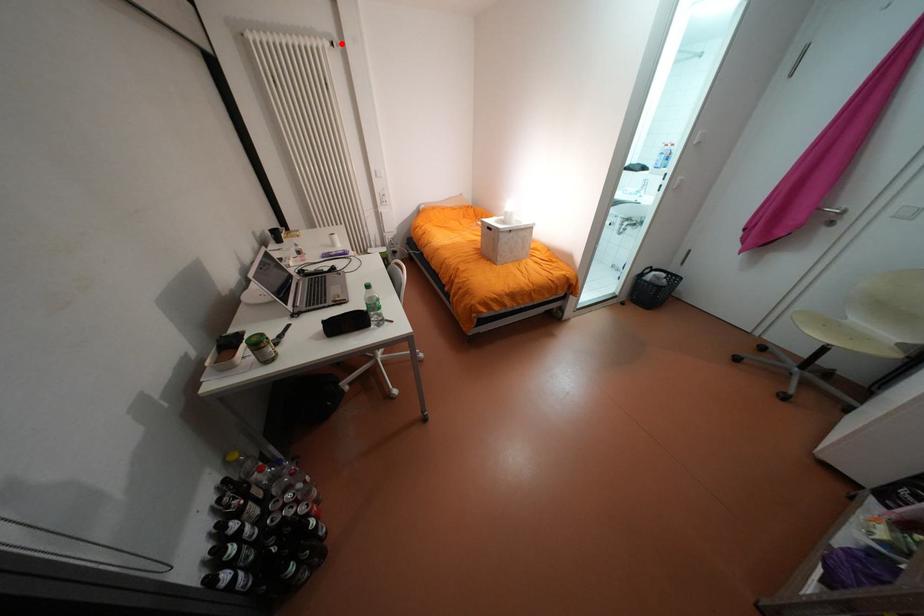
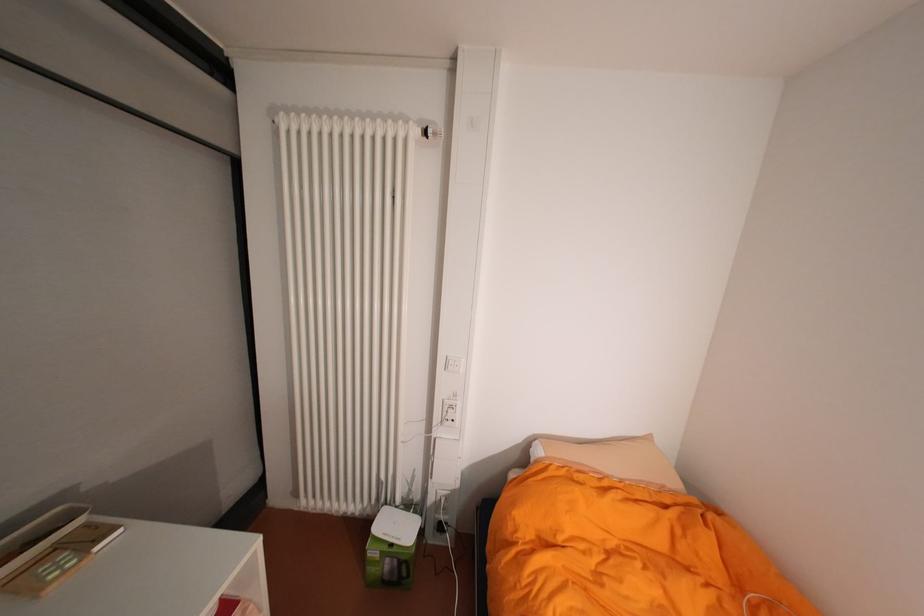
In the second image, find the point that corresponds to the highlighted location in the first image.

(434, 132)